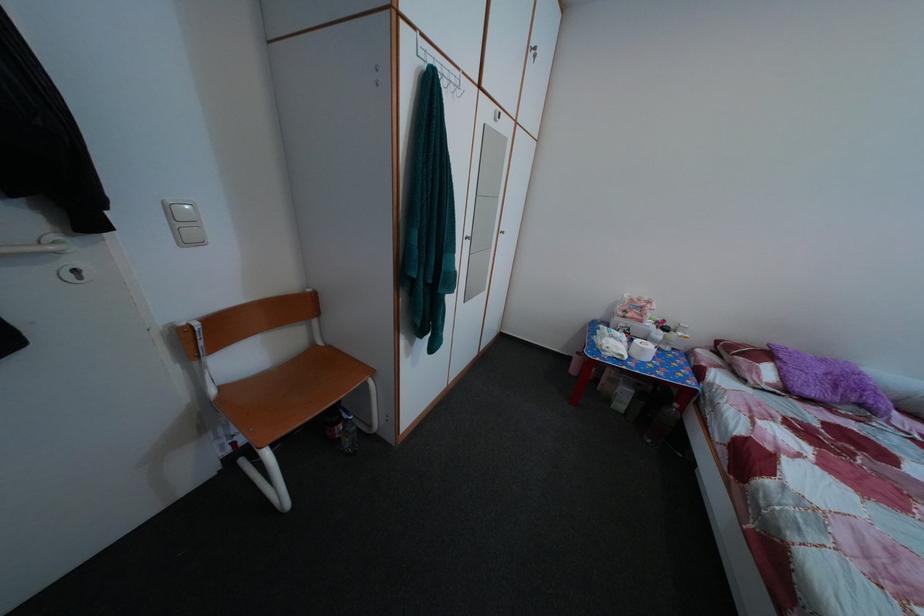
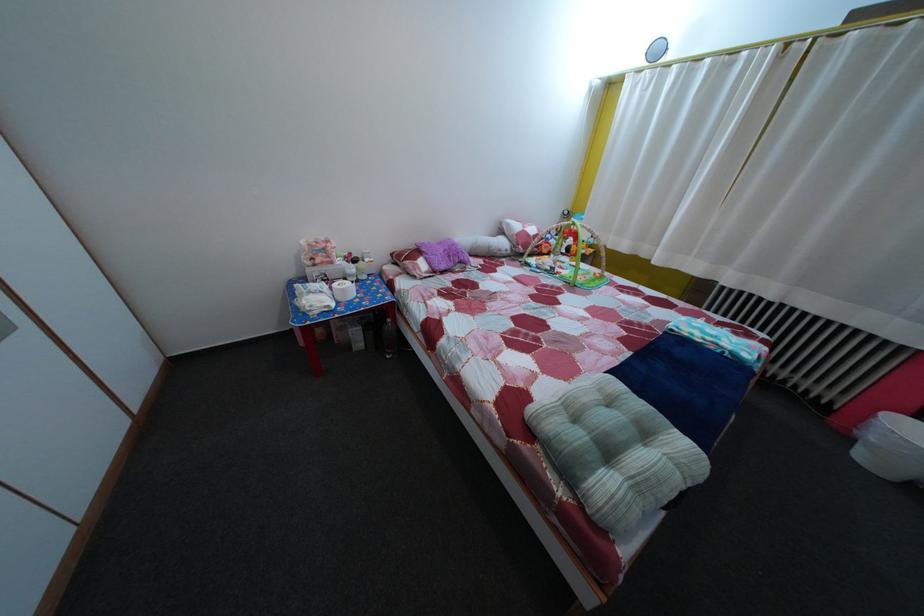
Locate, in the second image, the point that corresponds to (x=638, y=338) in the first image.

(335, 284)